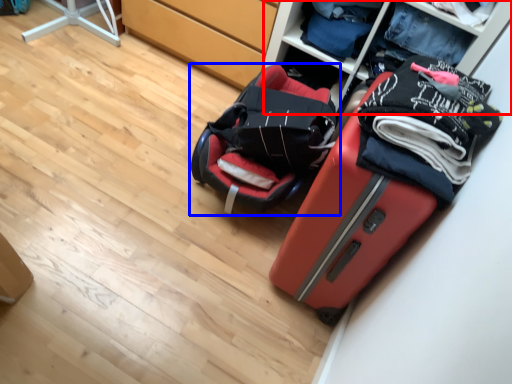
Question: Which object is further to the camera taking this photo, shelf (highlighted by a red box) or luggage and bags (highlighted by a blue box)?

Choices:
 (A) shelf
 (B) luggage and bags

Answer: (A)